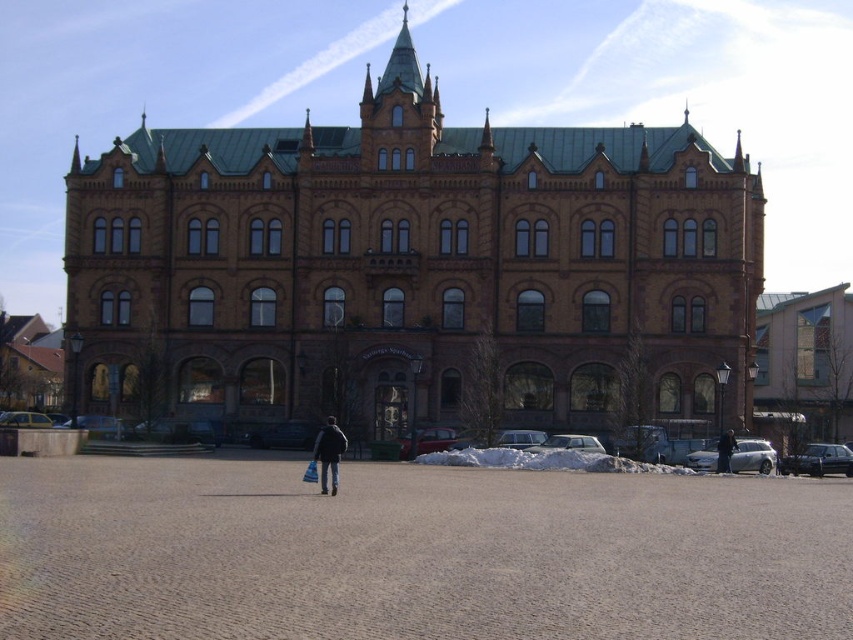
Question: Is dark blue fabric at center bigger than black leather jacket at center?

Choices:
 (A) yes
 (B) no

Answer: (A)

Question: Is dark blue fabric at center smaller than black leather jacket at center?

Choices:
 (A) yes
 (B) no

Answer: (B)

Question: Which point is farther to the camera?

Choices:
 (A) (329, 419)
 (B) (726, 438)

Answer: (B)

Question: Is dark blue fabric at center in front of black leather jacket at center?

Choices:
 (A) no
 (B) yes

Answer: (B)